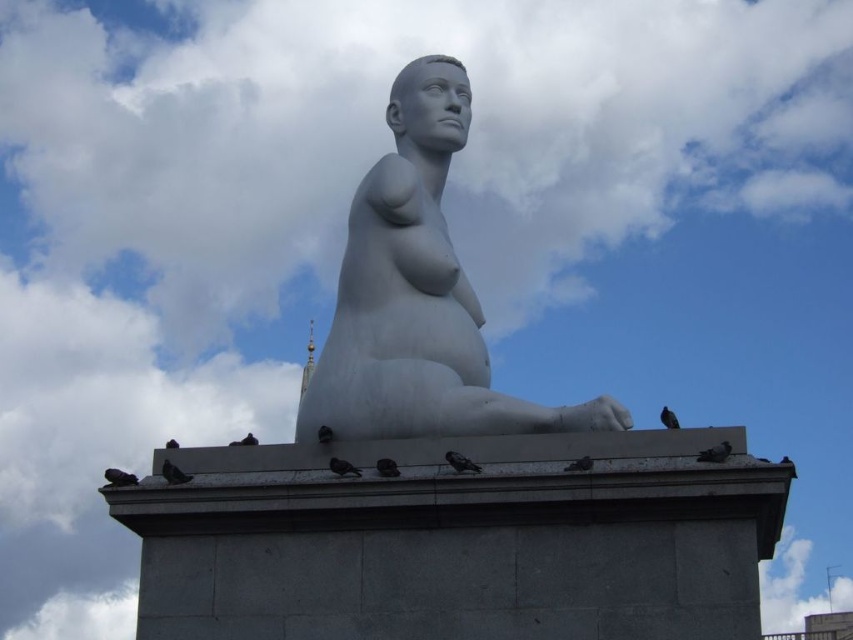
Is point (108, 467) positioned in front of point (253, 442)?

Yes, point (108, 467) is closer to viewer.

Can you confirm if dark gray feathers at lower left is smaller than brown feathered bird at lower center?

Indeed, dark gray feathers at lower left has a smaller size compared to brown feathered bird at lower center.

Between point (114, 477) and point (248, 436), which one is positioned behind?

The point (248, 436) is behind.

In order to click on dark gray feathers at lower left in this screenshot , I will do `click(119, 477)`.

Can you confirm if gray feathered pigeon at lower right is positioned to the left of black matte bird at center?

Incorrect, gray feathered pigeon at lower right is not on the left side of black matte bird at center.

Does gray feathered pigeon at lower right have a smaller size compared to black matte bird at center?

No.

Where is `gray feathered pigeon at lower right`? This screenshot has height=640, width=853. gray feathered pigeon at lower right is located at coordinates (715, 452).

Identify the location of gray feathered pigeon at lower right. Image resolution: width=853 pixels, height=640 pixels. (715, 452).

Which of these two, black feathered bird at center or dark gray feathers at upper center, stands shorter?

Standing shorter between the two is black feathered bird at center.

From the picture: Does black feathered bird at center have a larger size compared to dark gray feathers at upper center?

Yes, black feathered bird at center is bigger than dark gray feathers at upper center.

Between point (448, 461) and point (780, 460), which one is positioned in front?

Point (780, 460) is in front.

Locate an element on the screen. Image resolution: width=853 pixels, height=640 pixels. black feathered bird at center is located at coordinates (461, 461).